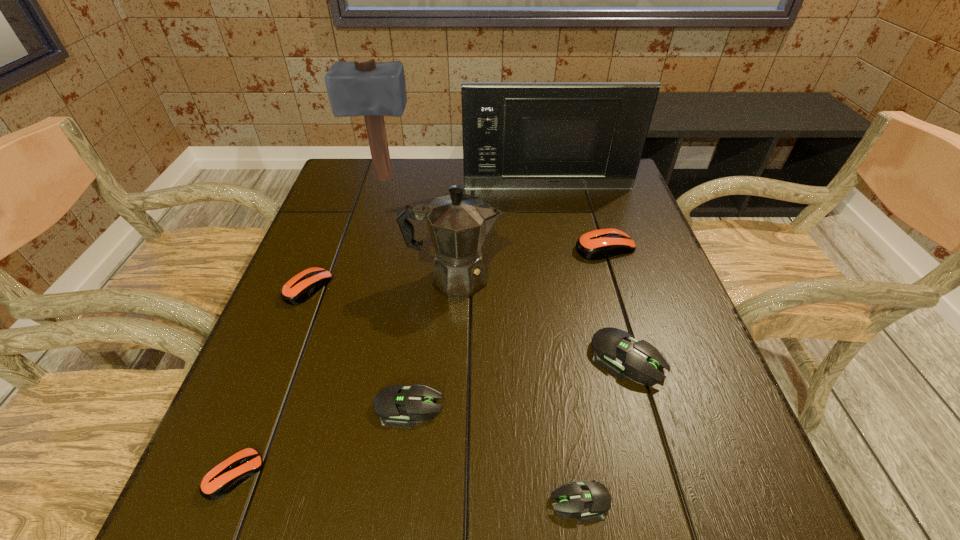
You are a GUI agent. You are given a task and a screenshot of the screen. Output one action in this format:
    pyautogui.click(x=<x>, y=<y>)
    Task: Click on the nearest orange computer mouse
    
    Given the screenshot: What is the action you would take?
    pyautogui.click(x=224, y=477)

Locate an element on the screen. The width and height of the screenshot is (960, 540). the nearest gray computer mouse is located at coordinates (589, 500).

Find the location of a particular element. the fourth computer mouse from left to right is located at coordinates (589, 500).

Where is `free region located on the right of the mallet`? The image size is (960, 540). free region located on the right of the mallet is located at coordinates (458, 178).

Image resolution: width=960 pixels, height=540 pixels. I want to click on free space located on the front panel of the dark microwave oven, so click(x=557, y=231).

Locate an element on the screen. free space located 0.300m on the pouring side of the third tallest object is located at coordinates (632, 278).

Locate an element on the screen. The height and width of the screenshot is (540, 960). vacant region located on the left of the rightmost orange computer mouse is located at coordinates (545, 247).

In order to click on free space located on the back of the rightmost gray computer mouse in this screenshot , I will do `click(591, 236)`.

You are a GUI agent. You are given a task and a screenshot of the screen. Output one action in this format:
    pyautogui.click(x=<x>, y=<y>)
    Task: Click on the free space located on the right of the second farthest orange computer mouse
    This screenshot has height=540, width=960.
    Given the screenshot: What is the action you would take?
    pyautogui.click(x=367, y=287)

The image size is (960, 540). I want to click on free space located 0.160m on the front of the second smallest gray computer mouse, so click(393, 534).